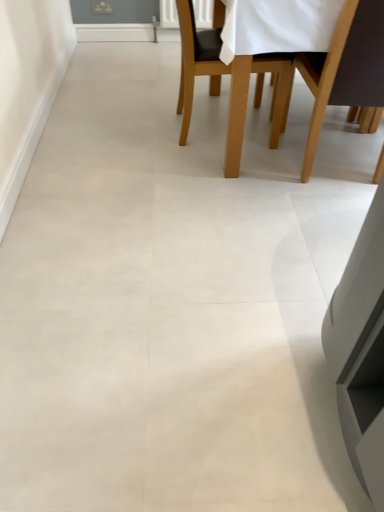
This screenshot has width=384, height=512. Identify the location of free space in front of light brown wooden chair at upper center, which appears as the 1th chair when viewed from the left. (198, 165).